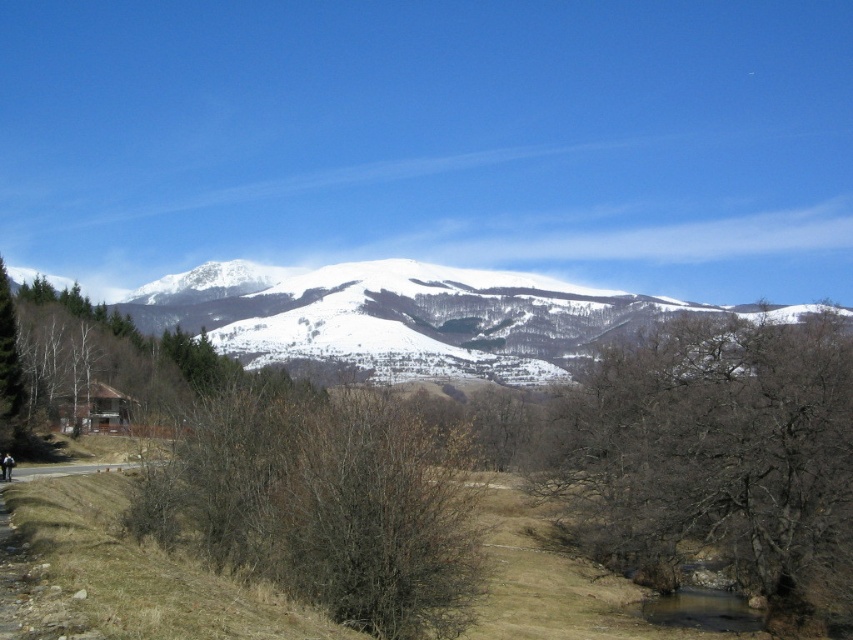
Can you confirm if brown leafless tree at center is wider than white snow-covered mountain at upper center?

No.

Consider the image. Between brown leafless tree at center and white snow-covered mountain at upper center, which one has less height?

With less height is brown leafless tree at center.

You are a GUI agent. You are given a task and a screenshot of the screen. Output one action in this format:
    pyautogui.click(x=<x>, y=<y>)
    Task: Click on the brown leafless tree at center
    This screenshot has width=853, height=640.
    Given the screenshot: What is the action you would take?
    pyautogui.click(x=714, y=458)

Does brown/dry wood at center appear under white snow-covered mountain at upper center?

Yes, brown/dry wood at center is below white snow-covered mountain at upper center.

Who is shorter, brown/dry wood at center or white snow-covered mountain at upper center?

Standing shorter between the two is brown/dry wood at center.

The image size is (853, 640). Describe the element at coordinates (325, 502) in the screenshot. I see `brown/dry wood at center` at that location.

Where is `brown/dry wood at center`? Image resolution: width=853 pixels, height=640 pixels. brown/dry wood at center is located at coordinates (325, 502).

Does brown leafless tree at center have a lesser width compared to brown/dry wood at center?

No.

Can you confirm if brown leafless tree at center is bigger than brown/dry wood at center?

Yes.

Which is in front, point (764, 548) or point (473, 588)?

Point (473, 588) is more forward.

The width and height of the screenshot is (853, 640). I want to click on brown leafless tree at center, so click(x=714, y=458).